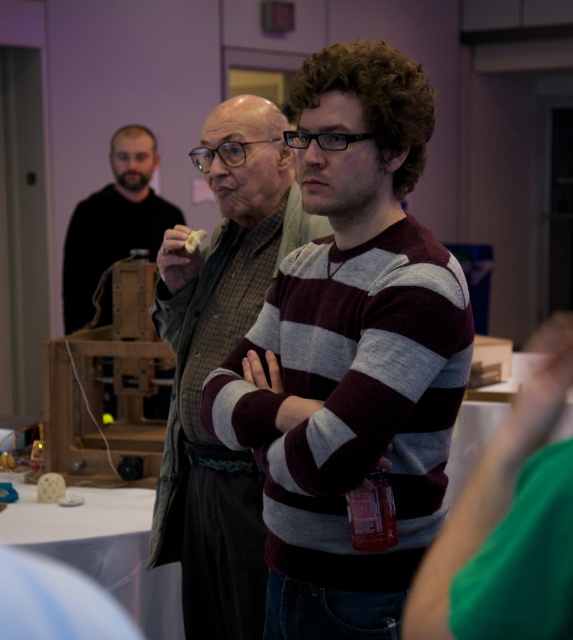
Question: Observing the image, what is the correct spatial positioning of striped cotton sweater at center in reference to yellow crumbly food at center?

Choices:
 (A) right
 (B) left

Answer: (A)

Question: Which of the following is the closest to the observer?

Choices:
 (A) striped cotton sweater at center
 (B) matte black shirt at left
 (C) striped sweater at center
 (D) yellow crumbly food at center

Answer: (A)

Question: Is matte black shirt at left thinner than yellow crumbly food at center?

Choices:
 (A) yes
 (B) no

Answer: (B)

Question: Can you confirm if matte black shirt at left is wider than yellow crumbly food at center?

Choices:
 (A) yes
 (B) no

Answer: (A)

Question: Which point is closer to the camera taking this photo?

Choices:
 (A) (109, 307)
 (B) (194, 230)
 (C) (198, 148)
 (D) (315, 118)

Answer: (D)

Question: Which point is farther from the camera taking this photo?

Choices:
 (A) (174, 234)
 (B) (187, 244)

Answer: (A)